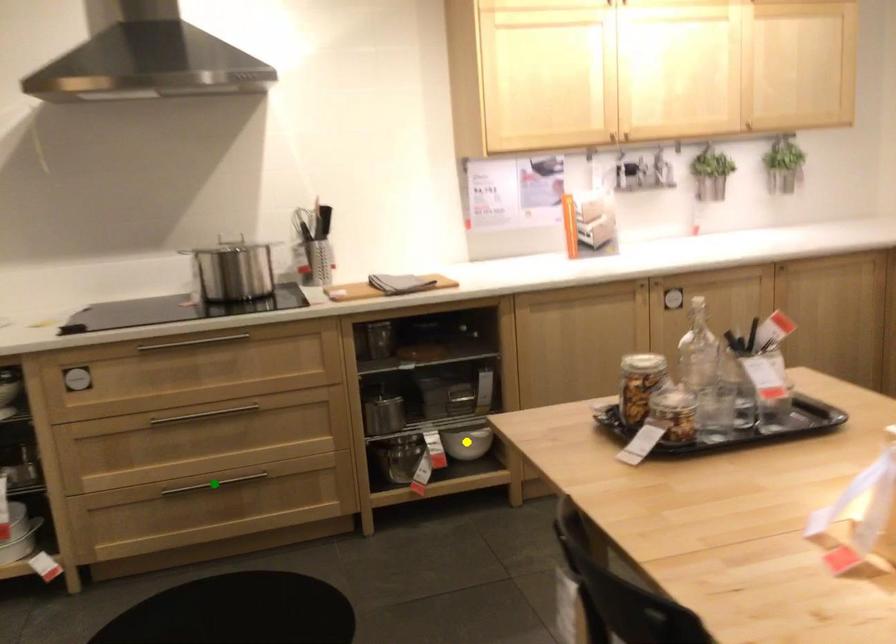
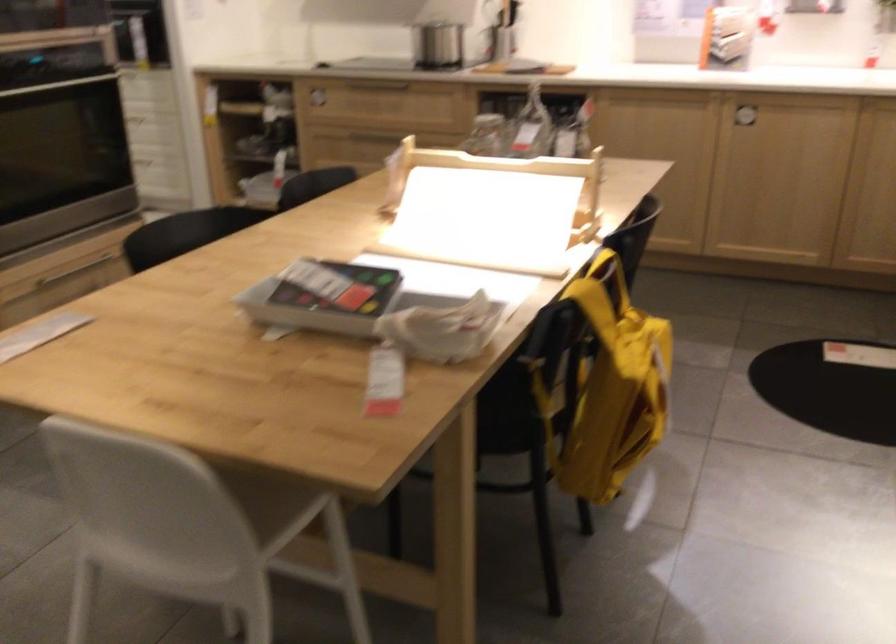
I am providing you with two images of the same scene from different viewpoints. Three points are marked in image1. Which point corresponds to a part or object that is occluded in image2?In image1, three points are marked. Which of them correspond to a part or object that is occluded in image2?Among the three points shown in image1, which one corresponds to a part or object that is no longer visible due to occlusion in image2?

green point, blue point, yellow point